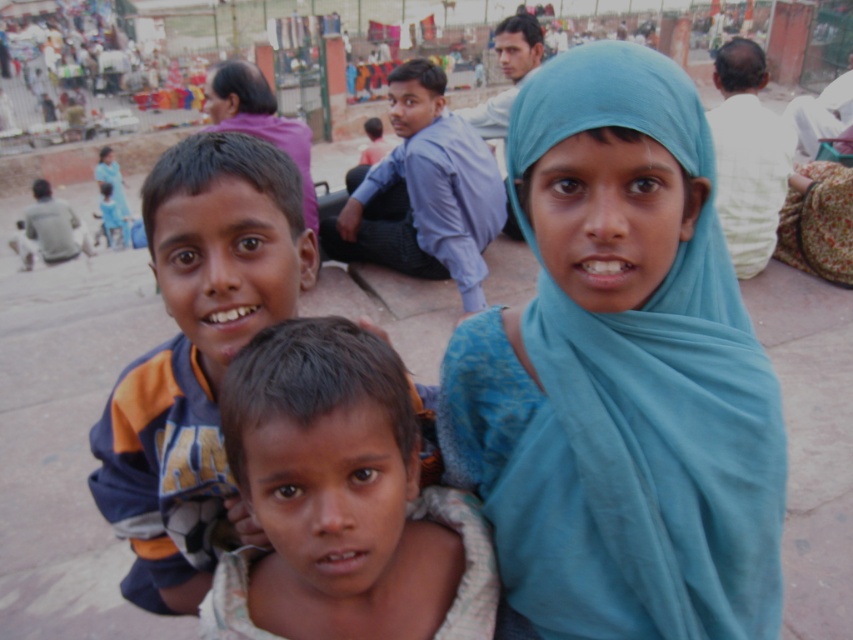
You are standing at the origin of the coordinate system in the image. You want to move towards the point labeled as point [573,604]. However, there is an obstacle at point [212,273]. Will you collide with the obstacle before reaching your destination?

Since point [573,604] is behind point [212,273], moving towards point [573,604] would require passing behind point [212,273], so you would not collide with the obstacle at point [212,273] before reaching your destination.

You are a photographer adjusting your camera to focus on the blue fabric headscarf at upper right. The camera has a focus point at coordinates point (x=619, y=376). Where should you look to ensure the focus point is correctly positioned?

The point (x=619, y=376) indicates the location of the blue fabric headscarf at upper right, so you should position the focus point at those coordinates to ensure the blue fabric headscarf at upper right is in focus.